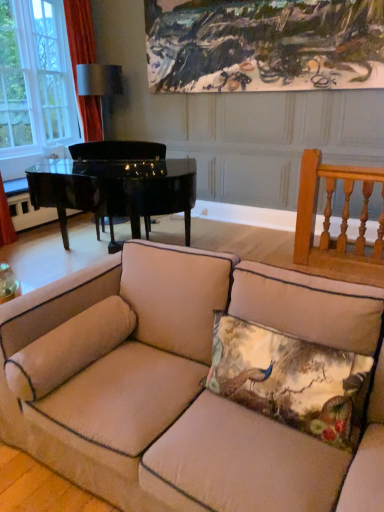
Question: From the image's perspective, is beige fabric couch at center on top of beige fabric pillow at lower left, which ranks as the second pillow in right-to-left order?

Choices:
 (A) no
 (B) yes

Answer: (A)

Question: Can you confirm if beige fabric couch at center is bigger than beige fabric pillow at lower left, which ranks as the second pillow in right-to-left order?

Choices:
 (A) yes
 (B) no

Answer: (A)

Question: Is beige fabric couch at center behind beige fabric pillow at lower left, which ranks as the second pillow in right-to-left order?

Choices:
 (A) no
 (B) yes

Answer: (A)

Question: Is beige fabric couch at center facing towards beige fabric pillow at lower left, which ranks as the first pillow in left-to-right order?

Choices:
 (A) no
 (B) yes

Answer: (B)

Question: Is beige fabric couch at center taller than beige fabric pillow at lower left, which ranks as the second pillow in right-to-left order?

Choices:
 (A) no
 (B) yes

Answer: (B)

Question: Can you confirm if beige fabric couch at center is wider than beige fabric pillow at lower left, which ranks as the second pillow in right-to-left order?

Choices:
 (A) yes
 (B) no

Answer: (A)

Question: From the image's perspective, is orange fabric curtain at upper left above white fabric lampshade at upper center?

Choices:
 (A) yes
 (B) no

Answer: (A)

Question: Is orange fabric curtain at upper left outside white fabric lampshade at upper center?

Choices:
 (A) no
 (B) yes

Answer: (B)

Question: Considering the relative sizes of orange fabric curtain at upper left and white fabric lampshade at upper center in the image provided, is orange fabric curtain at upper left smaller than white fabric lampshade at upper center?

Choices:
 (A) no
 (B) yes

Answer: (A)

Question: Is orange fabric curtain at upper left at the left side of white fabric lampshade at upper center?

Choices:
 (A) no
 (B) yes

Answer: (B)

Question: Can you confirm if orange fabric curtain at upper left is shorter than white fabric lampshade at upper center?

Choices:
 (A) yes
 (B) no

Answer: (B)

Question: From a real-world perspective, is orange fabric curtain at upper left physically above white fabric lampshade at upper center?

Choices:
 (A) yes
 (B) no

Answer: (A)

Question: From the image's perspective, is clear glass window at upper left beneath orange fabric curtain at upper left?

Choices:
 (A) no
 (B) yes

Answer: (B)